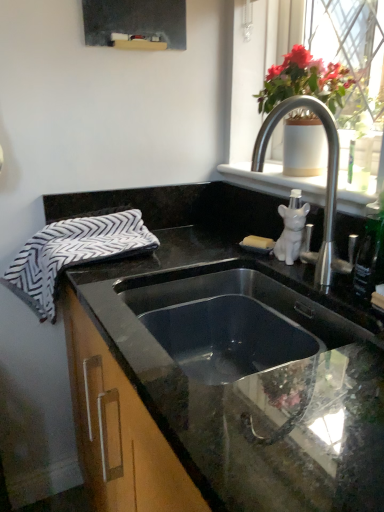
Image resolution: width=384 pixels, height=512 pixels. Describe the element at coordinates (291, 228) in the screenshot. I see `white ceramic dog at upper right` at that location.

Where is `black and white zigzag beach towel at left`? Image resolution: width=384 pixels, height=512 pixels. black and white zigzag beach towel at left is located at coordinates (72, 254).

Where is `white ceramic vase at upper right`? This screenshot has height=512, width=384. white ceramic vase at upper right is located at coordinates (274, 175).

From the image's perspective, is white ceramic dog at upper right on top of white ceramic vase at upper right?

Incorrect, from the image's perspective, white ceramic dog at upper right is lower than white ceramic vase at upper right.

Identify the location of window above the white ceramic dog at upper right (from a real-world perspective). (274, 175).

From a real-world perspective, is white ceramic dog at upper right located beneath white ceramic vase at upper right?

Yes, from a real-world perspective, white ceramic dog at upper right is beneath white ceramic vase at upper right.

What's the angular difference between white ceramic dog at upper right and white ceramic vase at upper right's facing directions?

0.775 degrees.

Is white ceramic vase at upper right to the left or to the right of satin nickel faucet at upper right in the image?

In the image, white ceramic vase at upper right appears on the right side of satin nickel faucet at upper right.

Are white ceramic vase at upper right and satin nickel faucet at upper right far apart?

No.

From the picture: Which is closer, [331,86] or [327,133]?

Answer: Point [331,86] is positioned farther from the camera compared to point [327,133].

Can you confirm if white matte soap dispenser at upper right is wider than black granite countertop at center?

No.

Is white matte soap dispenser at upper right not within black granite countertop at center?

Indeed, white matte soap dispenser at upper right is completely outside black granite countertop at center.

Considering their positions, is white matte soap dispenser at upper right located in front of or behind black granite countertop at center?

Visually, white matte soap dispenser at upper right is located behind black granite countertop at center.

Between white matte soap dispenser at upper right and black granite countertop at center, which one has smaller size?

white matte soap dispenser at upper right is smaller.

From a real-world perspective, which object stands above the other?

white ceramic vase at upper right is physically above.

From the image's perspective, is white matte soap dispenser at upper right over white ceramic vase at upper right?

No, from the image's perspective, white matte soap dispenser at upper right is not over white ceramic vase at upper right.

The height and width of the screenshot is (512, 384). I want to click on window sill in front of the white ceramic vase at upper right, so click(275, 181).

Considering the relative positions of black and white zigzag beach towel at left and white ceramic vase at upper right in the image provided, is black and white zigzag beach towel at left in front of white ceramic vase at upper right?

That is False.

How many degrees apart are the facing directions of black and white zigzag beach towel at left and white ceramic vase at upper right?

0.774 degrees.

Considering the positions of point (66, 265) and point (297, 181), is point (66, 265) closer or farther from the camera than point (297, 181)?

Point (66, 265) appears to be closer to the viewer than point (297, 181).

Based on the photo, from the image's perspective, is white matte soap dispenser at upper right above or below black and white zigzag beach towel at left?

white matte soap dispenser at upper right is situated higher than black and white zigzag beach towel at left in the image.

Are white matte soap dispenser at upper right and black and white zigzag beach towel at left beside each other?

No, white matte soap dispenser at upper right is not touching black and white zigzag beach towel at left.

Is white matte soap dispenser at upper right at the left side of black and white zigzag beach towel at left?

Incorrect, white matte soap dispenser at upper right is not on the left side of black and white zigzag beach towel at left.

Is white matte soap dispenser at upper right outside of black and white zigzag beach towel at left?

Yes, white matte soap dispenser at upper right is located beyond the bounds of black and white zigzag beach towel at left.

In the scene shown: From a real-world perspective, is black granite countertop at center located higher than white ceramic vase at upper right?

No.

Is point (231, 293) positioned behind point (347, 9)?

No, it is not.

Is black granite countertop at center aimed at white ceramic vase at upper right?

No.

Where is `toiletry below the white ceramic vase at upper right (from a real-world perspective)`? toiletry below the white ceramic vase at upper right (from a real-world perspective) is located at coordinates (291, 228).

I want to click on tap below the white ceramic vase at upper right (from the image's perspective), so click(x=326, y=185).

Looking at this image, when comparing their distances from white ceramic vase at upper right, does satin nickel faucet at upper right or white ceramic vase at upper right seem further?

satin nickel faucet at upper right is positioned further to the anchor white ceramic vase at upper right.

Looking at the image, which one is located further to black and white zigzag beach towel at left, white ceramic vase at upper right or white ceramic vase at upper right?

white ceramic vase at upper right is further to black and white zigzag beach towel at left.

Which object lies nearer to the anchor point white ceramic vase at upper right, black granite countertop at center or white ceramic vase at upper right?

white ceramic vase at upper right is positioned closer to the anchor white ceramic vase at upper right.

Estimate the real-world distances between objects in this image. Which object is closer to white ceramic vase at upper right, black and white zigzag beach towel at left or satin nickel faucet at upper right?

Among the two, satin nickel faucet at upper right is located nearer to white ceramic vase at upper right.

Considering their positions, is white matte soap dispenser at upper right positioned closer to white ceramic dog at upper right than white ceramic vase at upper right?

white matte soap dispenser at upper right is positioned closer to the anchor white ceramic dog at upper right.

When comparing their distances from white ceramic dog at upper right, does white ceramic vase at upper right or white ceramic vase at upper right seem further?

white ceramic vase at upper right.

Based on their spatial positions, is satin nickel faucet at upper right or black granite countertop at center further from white matte soap dispenser at upper right?

The object further to white matte soap dispenser at upper right is black granite countertop at center.

In the scene shown: Which object lies further to the anchor point white ceramic vase at upper right, white matte soap dispenser at upper right or black and white zigzag beach towel at left?

black and white zigzag beach towel at left is further to white ceramic vase at upper right.

Locate an element on the screen. The width and height of the screenshot is (384, 512). window sill between black and white zigzag beach towel at left and white ceramic vase at upper right is located at coordinates (275, 181).

Locate an element on the screen. tap between white matte soap dispenser at upper right and black granite countertop at center in the vertical direction is located at coordinates (326, 185).

The width and height of the screenshot is (384, 512). Identify the location of floral arrangement between black and white zigzag beach towel at left and white matte soap dispenser at upper right in the horizontal direction. (304, 80).

Find the location of a particular element. Image resolution: width=384 pixels, height=512 pixels. toiletry that lies between white ceramic vase at upper right and black granite countertop at center from top to bottom is located at coordinates (291, 228).